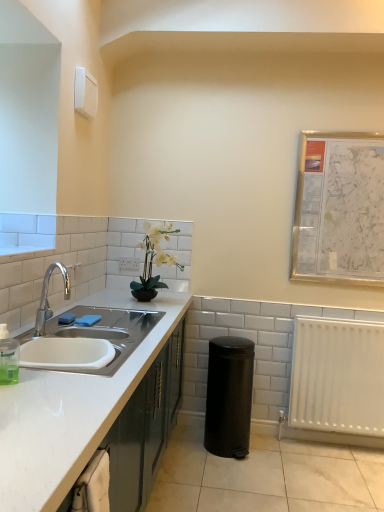
You are a GUI agent. You are given a task and a screenshot of the screen. Output one action in this format:
    pyautogui.click(x=<x>, y=<y>)
    Task: Click on the vacant space to the right of blue sponge at sink left
    Image resolution: width=384 pixels, height=512 pixels.
    Given the screenshot: What is the action you would take?
    pyautogui.click(x=112, y=326)